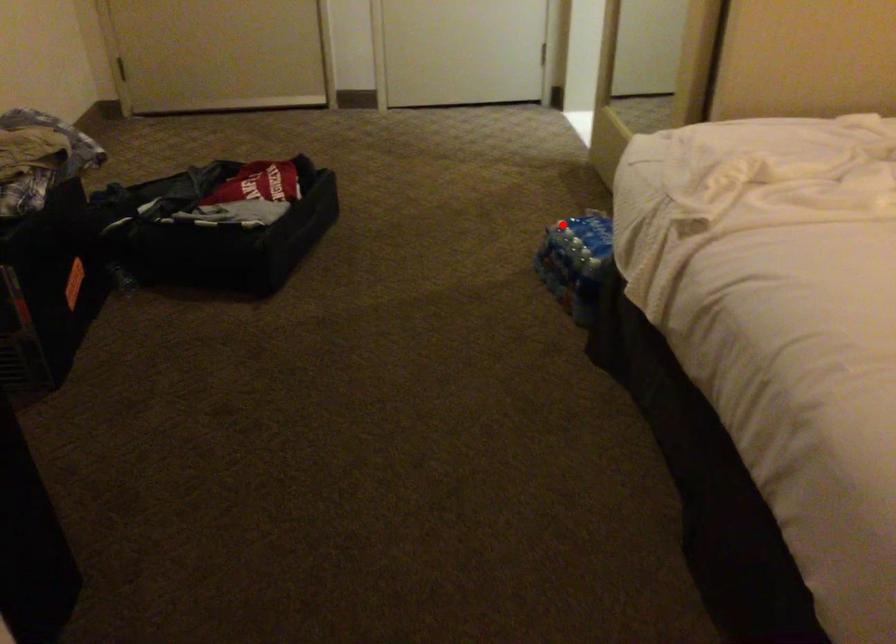
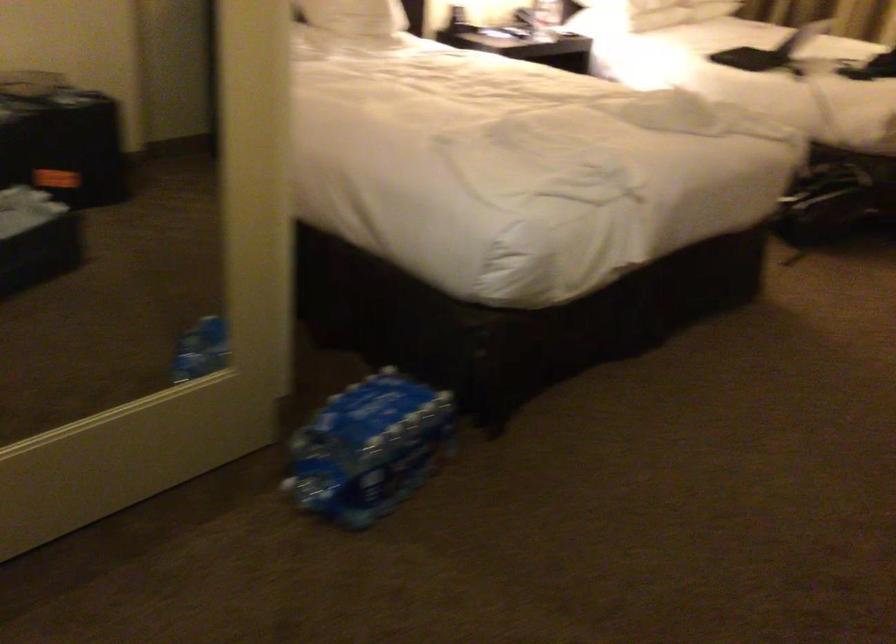
Find the pixel in the second image that matches the highlighted location in the first image.

(367, 448)